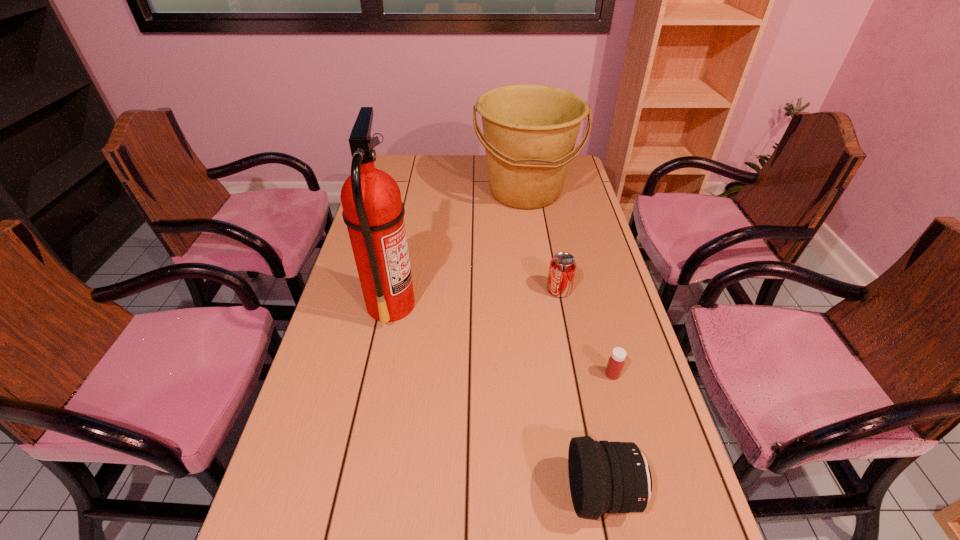
Locate an element on the screen. This screenshot has height=540, width=960. free region that satisfies the following two spatial constraints: 1. on the front side of the soda can; 2. on the right side of the fourth farthest object is located at coordinates (575, 374).

Identify the location of free region that satisfies the following two spatial constraints: 1. on the side of the farthest object with the handle; 2. on the side of the tallest object near the handle. (541, 304).